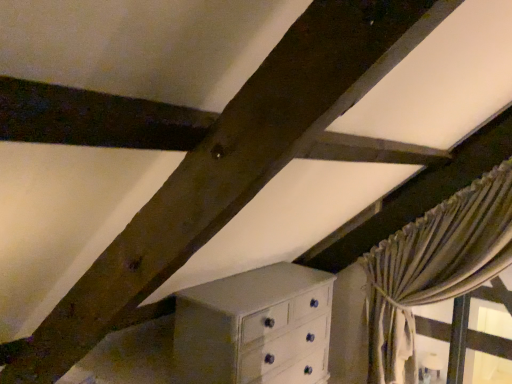
Question: Choose the correct answer: Is white painted wood chest of drawers at lower center inside silky beige curtain at right or outside it?

Choices:
 (A) outside
 (B) inside

Answer: (A)

Question: In terms of width, does white painted wood chest of drawers at lower center look wider or thinner when compared to silky beige curtain at right?

Choices:
 (A) wide
 (B) thin

Answer: (A)

Question: Considering the positions of point (270, 340) and point (396, 259), is point (270, 340) closer or farther from the camera than point (396, 259)?

Choices:
 (A) farther
 (B) closer

Answer: (B)

Question: Considering the positions of silky beige curtain at right and white painted wood chest of drawers at lower center in the image, is silky beige curtain at right wider or thinner than white painted wood chest of drawers at lower center?

Choices:
 (A) thin
 (B) wide

Answer: (A)

Question: From a real-world perspective, is silky beige curtain at right positioned above or below white painted wood chest of drawers at lower center?

Choices:
 (A) below
 (B) above

Answer: (B)

Question: From the image's perspective, is silky beige curtain at right above or below white painted wood chest of drawers at lower center?

Choices:
 (A) above
 (B) below

Answer: (A)

Question: Is point (409, 251) positioned closer to the camera than point (311, 299)?

Choices:
 (A) farther
 (B) closer

Answer: (A)